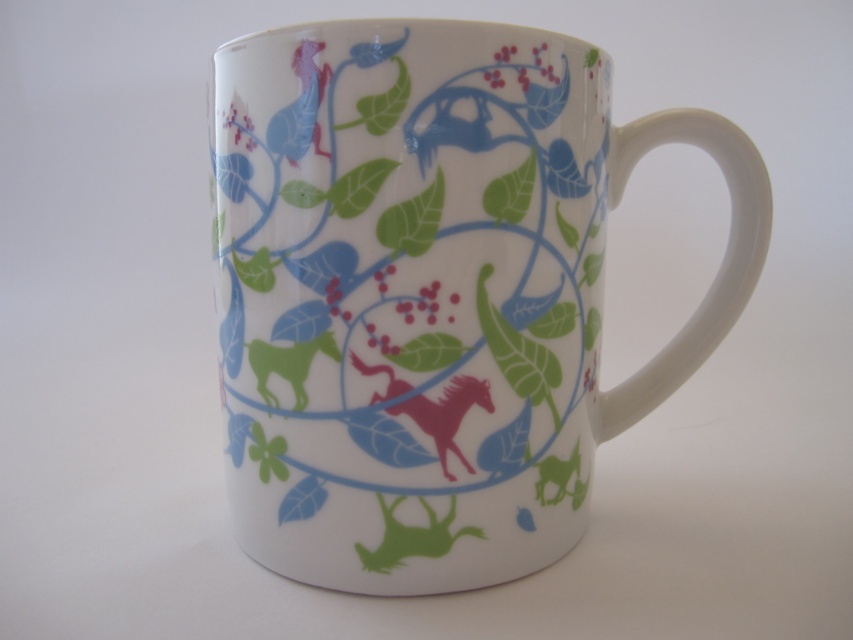
This screenshot has width=853, height=640. Describe the element at coordinates (433, 292) in the screenshot. I see `porcelain mug at center` at that location.

Which is below, porcelain mug at center or pink glossy horse at center?

Positioned lower is pink glossy horse at center.

The width and height of the screenshot is (853, 640). What do you see at coordinates (433, 292) in the screenshot?
I see `porcelain mug at center` at bounding box center [433, 292].

The image size is (853, 640). Identify the location of porcelain mug at center. (433, 292).